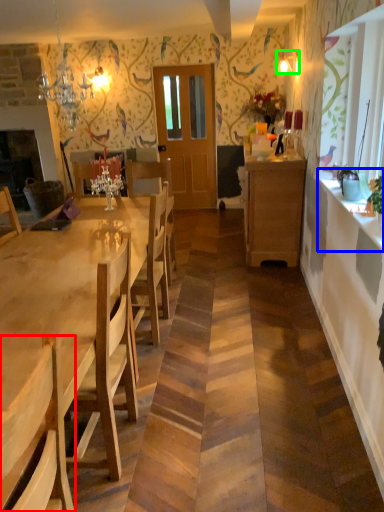
Question: Which is farther away from chair (highlighted by a red box)? counter top (highlighted by a blue box) or lamp (highlighted by a green box)?

Choices:
 (A) counter top
 (B) lamp

Answer: (B)